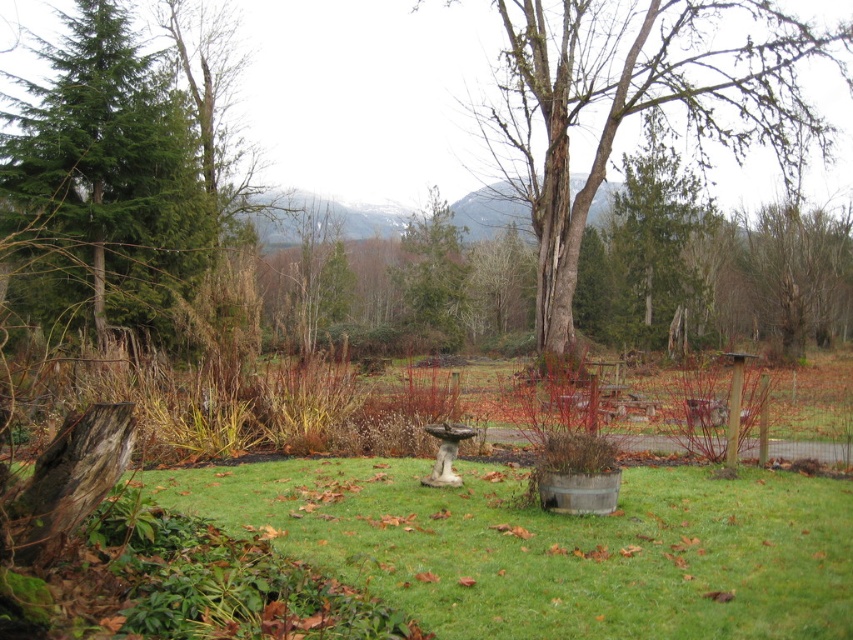
Which of these two, bark textured tree at center or green rough bark tree at center, stands taller?

bark textured tree at center is taller.

Looking at this image, which is below, bark textured tree at center or green rough bark tree at center?

Positioned lower is green rough bark tree at center.

Locate an element on the screen. bark textured tree at center is located at coordinates (637, 104).

Is green coniferous tree at left thinner than green rough bark tree at center?

Indeed, green coniferous tree at left has a lesser width compared to green rough bark tree at center.

Which is behind, point (80, 156) or point (641, 253)?

Point (641, 253)

You are a GUI agent. You are given a task and a screenshot of the screen. Output one action in this format:
    pyautogui.click(x=<x>, y=<y>)
    Task: Click on the green coniferous tree at left
    The height and width of the screenshot is (640, 853).
    Given the screenshot: What is the action you would take?
    pyautogui.click(x=105, y=173)

Is point (750, 138) closer to camera compared to point (109, 12)?

No, (750, 138) is further to viewer.

This screenshot has height=640, width=853. What do you see at coordinates (637, 104) in the screenshot? I see `bark textured tree at center` at bounding box center [637, 104].

Find the location of a particular element. bark textured tree at center is located at coordinates (637, 104).